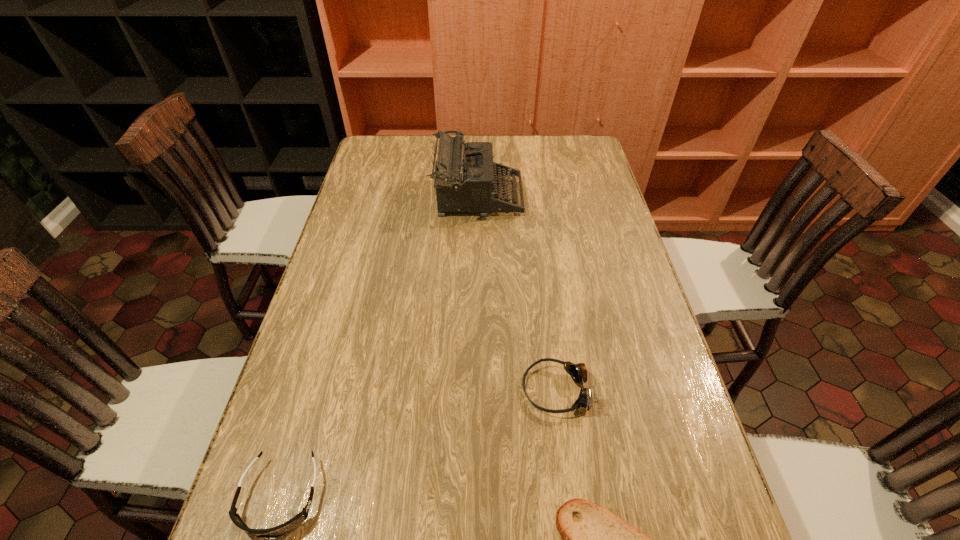
Where is `the farthest object`? The width and height of the screenshot is (960, 540). the farthest object is located at coordinates (465, 175).

This screenshot has width=960, height=540. Identify the location of typewriter. (465, 175).

Identify the location of the farther goggles. (578, 372).

I want to click on the third nearest object, so click(578, 372).

Where is `vacant space located on the typing side of the typewriter`? vacant space located on the typing side of the typewriter is located at coordinates (549, 197).

Locate an element on the screen. Image resolution: width=960 pixels, height=540 pixels. vacant space located 0.280m through the lenses of the right goggles is located at coordinates point(394,390).

Where is `free space located 0.170m through the lenses of the right goggles`? The height and width of the screenshot is (540, 960). free space located 0.170m through the lenses of the right goggles is located at coordinates (444, 390).

Locate an element on the screen. The width and height of the screenshot is (960, 540). free location located 0.360m through the lenses of the right goggles is located at coordinates (357, 390).

The height and width of the screenshot is (540, 960). I want to click on vacant space at the far edge, so click(543, 141).

In the image, there is a desktop. In order to click on vacant area at the left edge in this screenshot , I will do `click(385, 201)`.